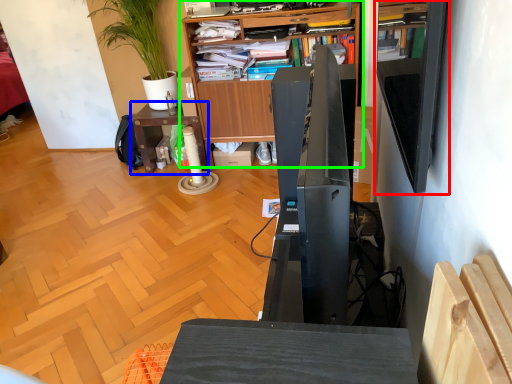
Question: Which object is positioned closest to shelf (highlighted by a red box)? Select from table (highlighted by a blue box) and bookcase (highlighted by a green box).

Choices:
 (A) table
 (B) bookcase

Answer: (B)